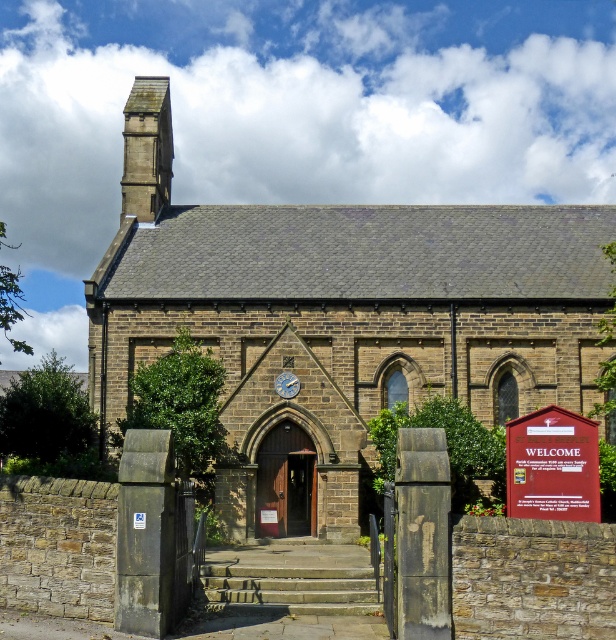
Between brown stone chapel at center and brown wooden door at center, which one has more height?

brown stone chapel at center

The image size is (616, 640). What do you see at coordinates (354, 321) in the screenshot? I see `brown stone chapel at center` at bounding box center [354, 321].

Does point (495, 208) lie behind point (286, 490)?

Yes.

This screenshot has height=640, width=616. Identify the location of brown stone chapel at center. (354, 321).

Can you confirm if wooden welcome sign at lower right is positioned to the left of stone spire at upper left?

Incorrect, wooden welcome sign at lower right is not on the left side of stone spire at upper left.

Does wooden welcome sign at lower right have a lesser width compared to stone spire at upper left?

Yes, wooden welcome sign at lower right is thinner than stone spire at upper left.

Image resolution: width=616 pixels, height=640 pixels. I want to click on wooden welcome sign at lower right, so click(x=553, y=465).

Can you confirm if concrete textured stairs at center is positioned to the right of brown wooden door at center?

Yes, concrete textured stairs at center is to the right of brown wooden door at center.

Is concrete textured stairs at center below brown wooden door at center?

Yes.

Which is in front, point (308, 576) or point (298, 512)?

Point (308, 576) is more forward.

The image size is (616, 640). Find the location of `concrete textured stairs at center`. concrete textured stairs at center is located at coordinates (288, 588).